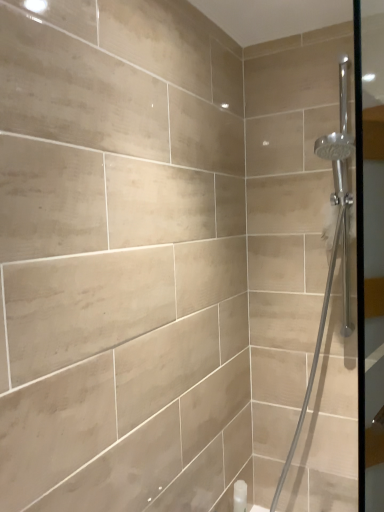
The height and width of the screenshot is (512, 384). Describe the element at coordinates (332, 244) in the screenshot. I see `satin nickel showerhead at right` at that location.

Find the location of `satin nickel showerhead at right`. satin nickel showerhead at right is located at coordinates (332, 244).

Locate an element on the screen. The width and height of the screenshot is (384, 512). satin nickel showerhead at right is located at coordinates (332, 244).